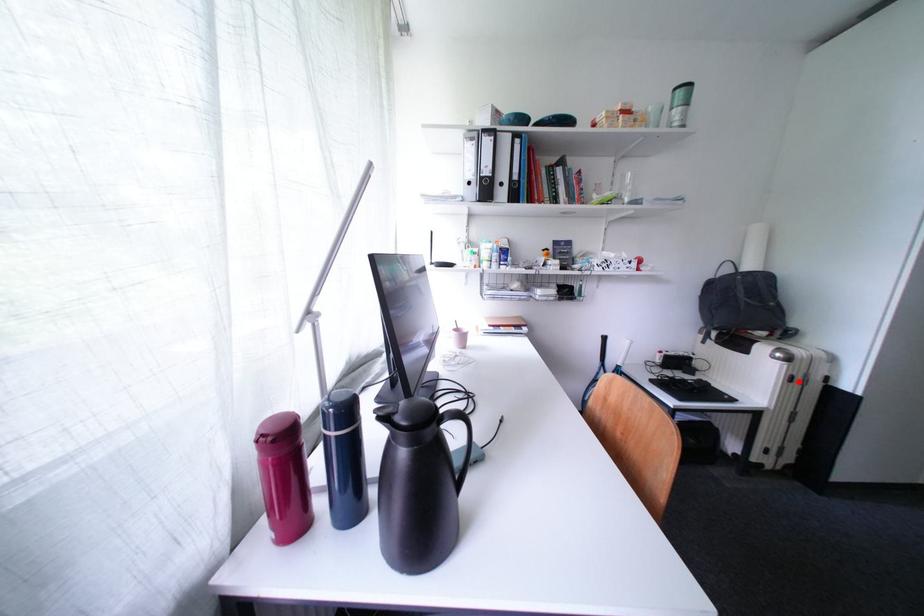
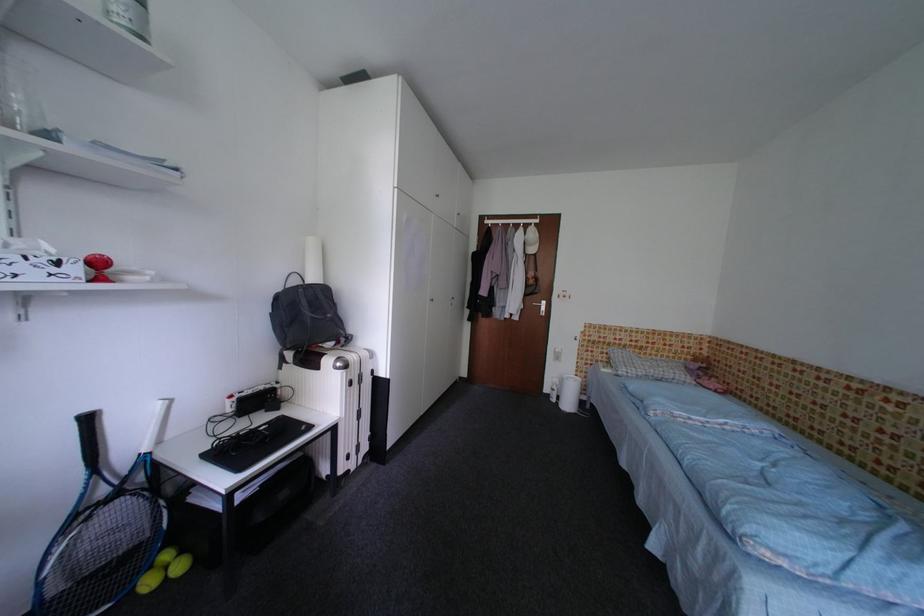
In the second image, find the point that corresponds to the highlighted location in the first image.

(359, 386)